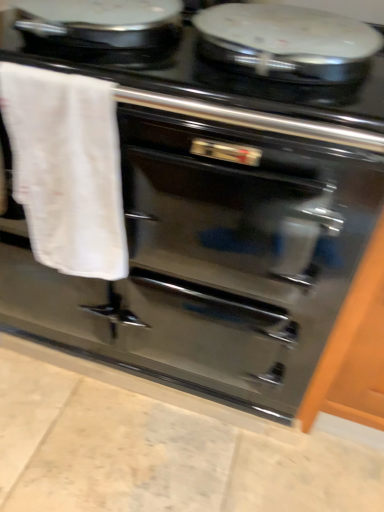
Question: Is white cotton towel at left with black glossy stove at upper center?

Choices:
 (A) yes
 (B) no

Answer: (B)

Question: Is white cotton towel at left positioned with its back to black glossy stove at upper center?

Choices:
 (A) no
 (B) yes

Answer: (B)

Question: Does white cotton towel at left have a larger size compared to black glossy stove at upper center?

Choices:
 (A) no
 (B) yes

Answer: (A)

Question: From the image's perspective, is white cotton towel at left on black glossy stove at upper center?

Choices:
 (A) no
 (B) yes

Answer: (A)

Question: From a real-world perspective, does white cotton towel at left stand above black glossy stove at upper center?

Choices:
 (A) yes
 (B) no

Answer: (B)

Question: Is black glossy stove at upper center surrounded by white cotton towel at left?

Choices:
 (A) yes
 (B) no

Answer: (B)

Question: Is glossy wood cabinet at right facing towards black glossy stove at upper center?

Choices:
 (A) no
 (B) yes

Answer: (A)

Question: Is the depth of glossy wood cabinet at right less than that of black glossy stove at upper center?

Choices:
 (A) yes
 (B) no

Answer: (B)

Question: Considering the relative sizes of glossy wood cabinet at right and black glossy stove at upper center in the image provided, is glossy wood cabinet at right bigger than black glossy stove at upper center?

Choices:
 (A) yes
 (B) no

Answer: (A)

Question: Considering the relative positions of glossy wood cabinet at right and black glossy stove at upper center in the image provided, is glossy wood cabinet at right to the left of black glossy stove at upper center from the viewer's perspective?

Choices:
 (A) no
 (B) yes

Answer: (A)

Question: Does glossy wood cabinet at right have a smaller size compared to black glossy stove at upper center?

Choices:
 (A) yes
 (B) no

Answer: (B)

Question: Is glossy wood cabinet at right shorter than black glossy stove at upper center?

Choices:
 (A) no
 (B) yes

Answer: (A)

Question: From a real-world perspective, is glossy wood cabinet at right located beneath white cotton towel at left?

Choices:
 (A) no
 (B) yes

Answer: (B)